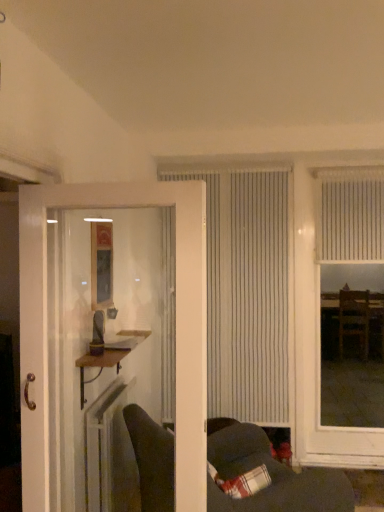
Question: Considering the relative positions of dark gray fabric couch at lower center and white vertical blinds at center, the 1th window viewed from the left, in the image provided, is dark gray fabric couch at lower center to the right of white vertical blinds at center, the 1th window viewed from the left, from the viewer's perspective?

Choices:
 (A) no
 (B) yes

Answer: (A)

Question: Is dark gray fabric couch at lower center thinner than white vertical blinds at center, the 1th window viewed from the left?

Choices:
 (A) yes
 (B) no

Answer: (B)

Question: From a real-world perspective, is dark gray fabric couch at lower center located beneath white vertical blinds at center, the second window viewed from the right?

Choices:
 (A) no
 (B) yes

Answer: (B)

Question: Is dark gray fabric couch at lower center oriented towards white vertical blinds at center, the second window viewed from the right?

Choices:
 (A) yes
 (B) no

Answer: (B)

Question: Is dark gray fabric couch at lower center outside white vertical blinds at center, the second window viewed from the right?

Choices:
 (A) no
 (B) yes

Answer: (B)

Question: Based on their positions, is white wooden door at left located to the left or right of white vertical blinds at right, placed as the second window when sorted from left to right?

Choices:
 (A) right
 (B) left

Answer: (B)

Question: Is white wooden door at left wider or thinner than white vertical blinds at right, which ranks as the first window in right-to-left order?

Choices:
 (A) thin
 (B) wide

Answer: (B)

Question: Looking at the image, does white wooden door at left seem bigger or smaller compared to white vertical blinds at right, which ranks as the first window in right-to-left order?

Choices:
 (A) small
 (B) big

Answer: (B)

Question: Considering the positions of white wooden door at left and white vertical blinds at right, placed as the second window when sorted from left to right, in the image, is white wooden door at left taller or shorter than white vertical blinds at right, placed as the second window when sorted from left to right,?

Choices:
 (A) short
 (B) tall

Answer: (A)

Question: Is plaid fabric pillow at lower right bigger or smaller than white wooden door at left?

Choices:
 (A) big
 (B) small

Answer: (B)

Question: Relative to white wooden door at left, is plaid fabric pillow at lower right in front or behind?

Choices:
 (A) behind
 (B) front

Answer: (A)

Question: From a real-world perspective, relative to white wooden door at left, is plaid fabric pillow at lower right vertically above or below?

Choices:
 (A) below
 (B) above

Answer: (A)

Question: From the image's perspective, is plaid fabric pillow at lower right above or below white wooden door at left?

Choices:
 (A) above
 (B) below

Answer: (B)

Question: In terms of size, does white vertical blinds at right, which ranks as the first window in right-to-left order, appear bigger or smaller than wooden shelf at left?

Choices:
 (A) small
 (B) big

Answer: (B)

Question: Is white vertical blinds at right, which ranks as the first window in right-to-left order, in front of or behind wooden shelf at left in the image?

Choices:
 (A) behind
 (B) front

Answer: (A)